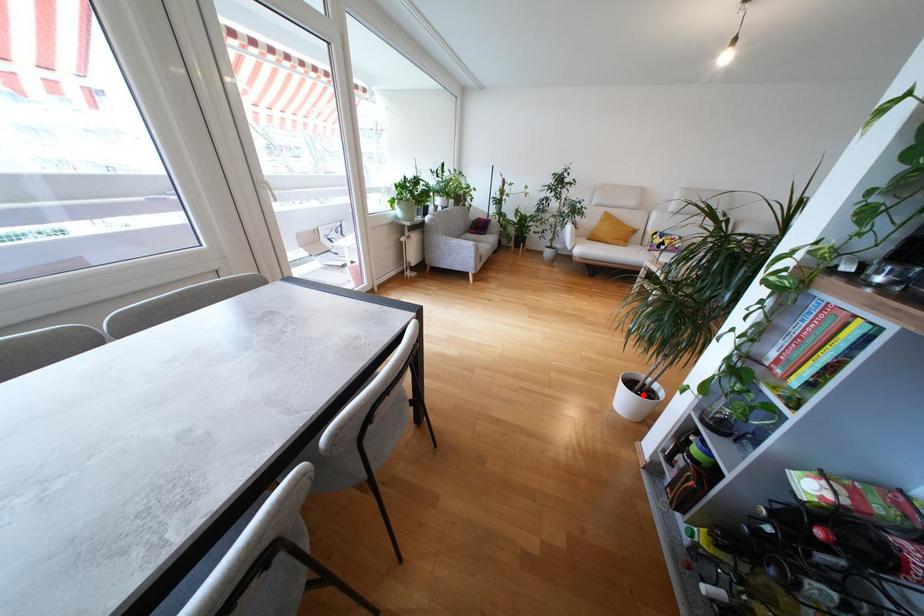
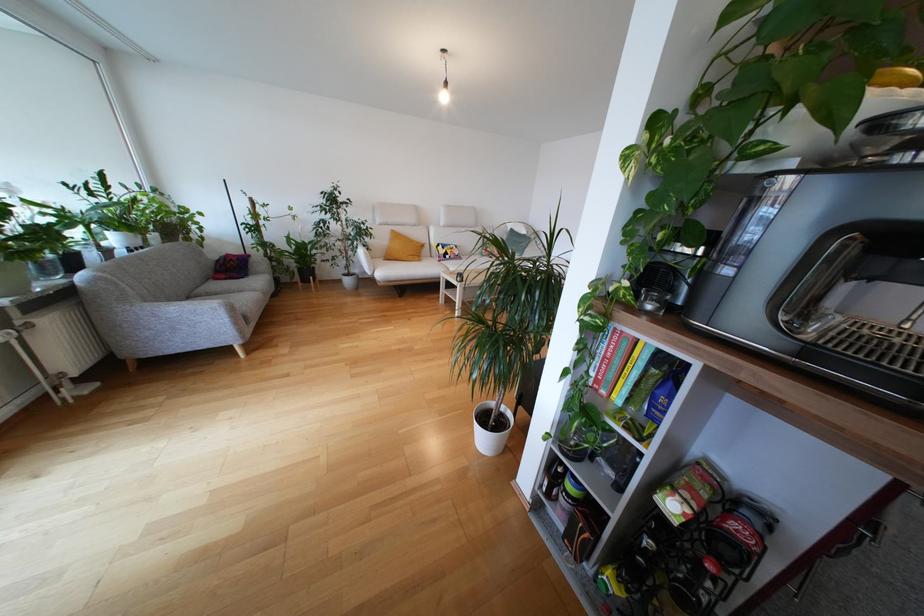
Where in the second image is the point corresponding to the highlighted location from the first image?

(497, 427)